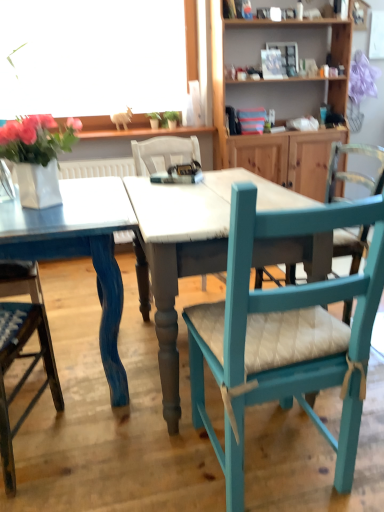
What do you see at coordinates (97, 238) in the screenshot? I see `blue painted wood table at center` at bounding box center [97, 238].

This screenshot has width=384, height=512. Describe the element at coordinates (284, 333) in the screenshot. I see `teal painted wood chair at right, acting as the 2th chair starting from the left` at that location.

What do you see at coordinates (277, 99) in the screenshot? The image size is (384, 512). I see `wooden cabinet at upper right` at bounding box center [277, 99].

Image resolution: width=384 pixels, height=512 pixels. What are the coordinates of `wooden chair with cushion at lower left, the 2th chair viewed from the right` in the screenshot? It's located at (21, 351).

In the image, there is a white glossy vase at upper left. At what (x,y) coordinates should I click in order to perform the action: click on shelf above it (from the image's perspective). Please return your answer as a coordinate pair (x, y). The image size is (384, 512). Looking at the image, I should click on (277, 99).

From the image's perspective, would you say white glossy vase at upper left is positioned over wooden cabinet at upper right?

No, from the image's perspective, white glossy vase at upper left is not above wooden cabinet at upper right.

Is white glossy vase at upper left not near wooden cabinet at upper right?

white glossy vase at upper left is far away from wooden cabinet at upper right.

Based on the photo, could you tell me if white glossy vase at upper left is turned towards wooden cabinet at upper right?

No, white glossy vase at upper left is not aimed at wooden cabinet at upper right.

Considering the positions of point (33, 318) and point (173, 330), is point (33, 318) closer or farther from the camera than point (173, 330)?

Point (33, 318) appears to be farther away from the viewer than point (173, 330).

Consider the image. Does wooden chair with cushion at lower left, the 2th chair viewed from the right, appear on the right side of blue painted wood table at center?

No, wooden chair with cushion at lower left, the 2th chair viewed from the right, is not to the right of blue painted wood table at center.

From a real-world perspective, is wooden chair with cushion at lower left, which is the first chair in left-to-right order, positioned above or below blue painted wood table at center?

From a real-world perspective, wooden chair with cushion at lower left, which is the first chair in left-to-right order, is physically above blue painted wood table at center.

Between wooden chair with cushion at lower left, the 2th chair viewed from the right, and blue painted wood table at center, which one has less height?

With less height is blue painted wood table at center.

From the image's perspective, is wooden cabinet at upper right above or below teal painted wood chair at right, arranged as the first chair when viewed from the right?

Based on their image positions, wooden cabinet at upper right is located above teal painted wood chair at right, arranged as the first chair when viewed from the right.

Is teal painted wood chair at right, acting as the 2th chair starting from the left, surrounded by wooden cabinet at upper right?

No, teal painted wood chair at right, acting as the 2th chair starting from the left, is not a part of wooden cabinet at upper right.

Can you tell me how much wooden cabinet at upper right and teal painted wood chair at right, arranged as the first chair when viewed from the right, differ in facing direction?

They differ by 179 degrees in their facing directions.

Considering the positions of point (216, 13) and point (22, 305), is point (216, 13) closer or farther from the camera than point (22, 305)?

Point (216, 13) is farther from the camera than point (22, 305).

Who is smaller, wooden cabinet at upper right or wooden chair with cushion at lower left, the 2th chair viewed from the right?

Smaller between the two is wooden chair with cushion at lower left, the 2th chair viewed from the right.

Which object is wider, wooden cabinet at upper right or wooden chair with cushion at lower left, the 2th chair viewed from the right?

Wider between the two is wooden chair with cushion at lower left, the 2th chair viewed from the right.

What's the angular difference between wooden cabinet at upper right and wooden chair with cushion at lower left, the 2th chair viewed from the right,'s facing directions?

There is a 170-degree angle between the facing directions of wooden cabinet at upper right and wooden chair with cushion at lower left, the 2th chair viewed from the right.

From the image's perspective, which object appears higher, teal painted wood chair at right, arranged as the first chair when viewed from the right, or blue painted wood table at center?

teal painted wood chair at right, arranged as the first chair when viewed from the right.

Is teal painted wood chair at right, acting as the 2th chair starting from the left, completely or partially outside of blue painted wood table at center?

Indeed, teal painted wood chair at right, acting as the 2th chair starting from the left, is completely outside blue painted wood table at center.

How many degrees apart are the facing directions of teal painted wood chair at right, arranged as the first chair when viewed from the right, and blue painted wood table at center?

180 degrees separate the facing orientations of teal painted wood chair at right, arranged as the first chair when viewed from the right, and blue painted wood table at center.

Is point (201, 401) positioned behind point (16, 134)?

Yes.

Are teal painted wood chair at right, arranged as the first chair when viewed from the right, and white glossy vase at upper left located far from each other?

No, teal painted wood chair at right, arranged as the first chair when viewed from the right, is in close proximity to white glossy vase at upper left.

Considering their positions, is teal painted wood chair at right, arranged as the first chair when viewed from the right, located in front of or behind white glossy vase at upper left?

In the image, teal painted wood chair at right, arranged as the first chair when viewed from the right, appears in front of white glossy vase at upper left.

Looking at this image, from a real-world perspective, is teal painted wood chair at right, arranged as the first chair when viewed from the right, positioned under white glossy vase at upper left based on gravity?

Correct, in the physical world, teal painted wood chair at right, arranged as the first chair when viewed from the right, is lower than white glossy vase at upper left.

From a real-world perspective, who is located higher, teal painted wood chair at right, acting as the 2th chair starting from the left, or wooden cabinet at upper right?

wooden cabinet at upper right.

Considering the relative positions of teal painted wood chair at right, acting as the 2th chair starting from the left, and wooden cabinet at upper right in the image provided, is teal painted wood chair at right, acting as the 2th chair starting from the left, in front of wooden cabinet at upper right?

Yes, the depth of teal painted wood chair at right, acting as the 2th chair starting from the left, is less than that of wooden cabinet at upper right.

From the image's perspective, which is above, teal painted wood chair at right, arranged as the first chair when viewed from the right, or wooden cabinet at upper right?

wooden cabinet at upper right, from the image's perspective.

Is teal painted wood chair at right, arranged as the first chair when viewed from the right, completely or partially outside of wooden cabinet at upper right?

Yes, teal painted wood chair at right, arranged as the first chair when viewed from the right, is outside of wooden cabinet at upper right.

This screenshot has width=384, height=512. In order to click on shelf above the white glossy vase at upper left (from the image's perspective) in this screenshot , I will do `click(277, 99)`.

This screenshot has height=512, width=384. I want to click on the 1st chair in front of the blue painted wood table at center, starting your count from the anchor, so click(21, 351).

Which object lies nearer to the anchor point white glossy vase at upper left, teal painted wood chair at right, arranged as the first chair when viewed from the right, or wooden chair with cushion at lower left, which is the first chair in left-to-right order?

Among the two, wooden chair with cushion at lower left, which is the first chair in left-to-right order, is located nearer to white glossy vase at upper left.

Estimate the real-world distances between objects in this image. Which object is further from teal painted wood chair at right, arranged as the first chair when viewed from the right, wooden chair with cushion at lower left, which is the first chair in left-to-right order, or white glossy vase at upper left?

white glossy vase at upper left is positioned further to the anchor teal painted wood chair at right, arranged as the first chair when viewed from the right.

From the picture: Looking at the image, which one is located further to blue painted wood table at center, white glossy vase at upper left or teal painted wood chair at right, acting as the 2th chair starting from the left?

white glossy vase at upper left lies further to blue painted wood table at center than the other object.

Looking at the image, which one is located further to teal painted wood chair at right, arranged as the first chair when viewed from the right, wooden cabinet at upper right or white glossy vase at upper left?

wooden cabinet at upper right.

Which object lies further to the anchor point white glossy vase at upper left, teal painted wood chair at right, arranged as the first chair when viewed from the right, or wooden cabinet at upper right?

wooden cabinet at upper right.

Looking at the image, which one is located further to wooden cabinet at upper right, wooden chair with cushion at lower left, the 2th chair viewed from the right, or white glossy vase at upper left?

wooden chair with cushion at lower left, the 2th chair viewed from the right.

Based on their spatial positions, is wooden cabinet at upper right or blue painted wood table at center closer to white glossy vase at upper left?

Based on the image, blue painted wood table at center appears to be nearer to white glossy vase at upper left.

Based on their spatial positions, is white glossy vase at upper left or wooden chair with cushion at lower left, which is the first chair in left-to-right order, further from teal painted wood chair at right, arranged as the first chair when viewed from the right?

white glossy vase at upper left.

Where is `kitchen & dining room table positioned between wooden chair with cushion at lower left, which is the first chair in left-to-right order, and wooden cabinet at upper right from near to far`? The width and height of the screenshot is (384, 512). kitchen & dining room table positioned between wooden chair with cushion at lower left, which is the first chair in left-to-right order, and wooden cabinet at upper right from near to far is located at coordinates (97, 238).

Identify the location of floral arrangement between blue painted wood table at center and wooden cabinet at upper right in the front-back direction. (37, 156).

Find the location of a particular element. kitchen & dining room table located between wooden chair with cushion at lower left, the 2th chair viewed from the right, and teal painted wood chair at right, arranged as the first chair when viewed from the right, in the left-right direction is located at coordinates (97, 238).

Image resolution: width=384 pixels, height=512 pixels. I want to click on floral arrangement between wooden chair with cushion at lower left, the 2th chair viewed from the right, and blue painted wood table at center, in the horizontal direction, so click(37, 156).